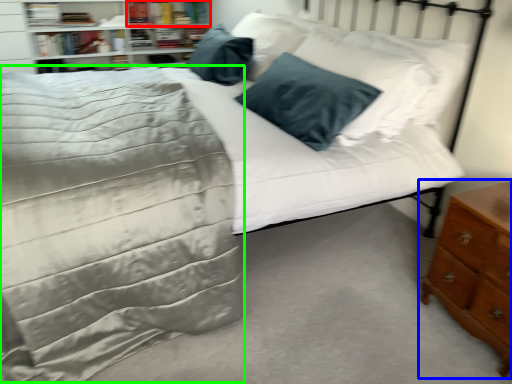
Question: Estimate the real-world distances between objects in this image. Which object is closer to book (highlighted by a red box), nightstand (highlighted by a blue box) or bedding (highlighted by a green box)?

Choices:
 (A) nightstand
 (B) bedding

Answer: (B)